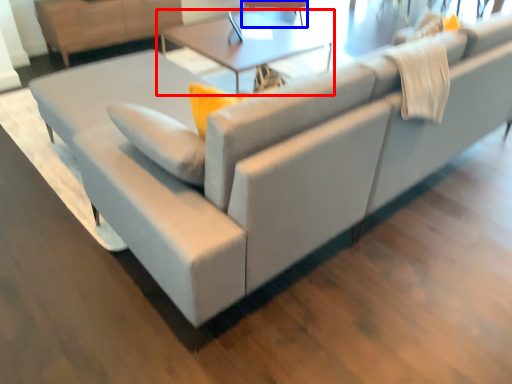
Question: Among these objects, which one is nearest to the camera, table (highlighted by a red box) or swivel chair (highlighted by a blue box)?

Choices:
 (A) table
 (B) swivel chair

Answer: (A)